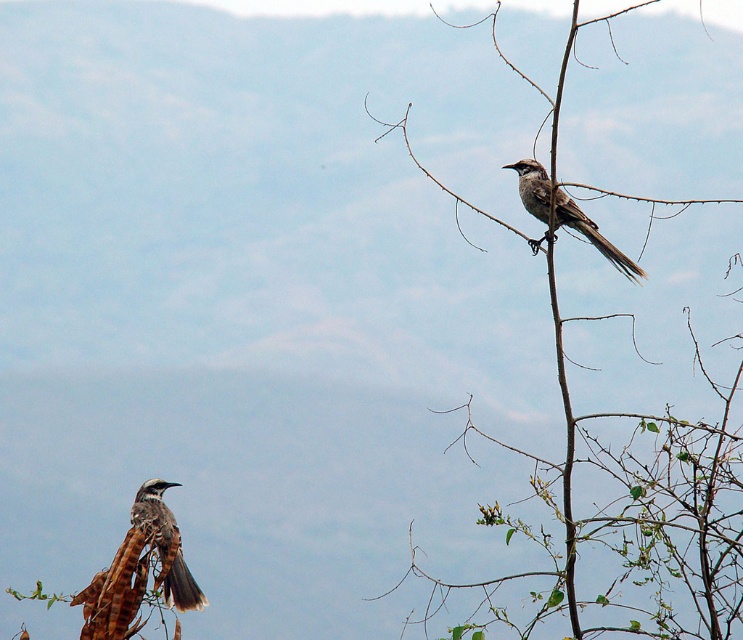
You are a birdwatcher observing the scene. You notice the brown textured branch at upper center and the brown speckled feathers at lower left. Which object is positioned closer to your viewpoint?

The brown textured branch at upper center is closer to the viewer than the brown speckled feathers at lower left.

You are standing in front of the tree and want to observe the two birds. Which bird is closer to you, the one at point (548, 184) or the one at point (160, 541)?

The bird at point (548, 184) is closer to you because point (548, 184) is closer to the camera than point (160, 541).